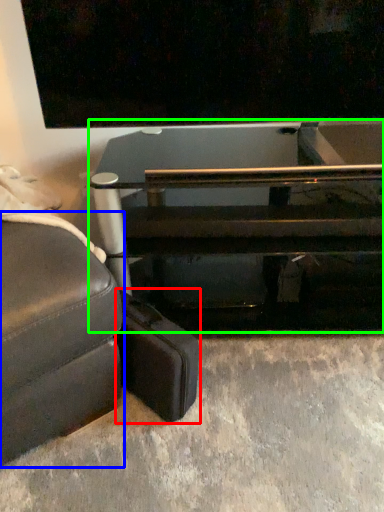
Question: Based on their relative distances, which object is farther from luggage (highlighted by a red box)? Choose from studio couch (highlighted by a blue box) and table (highlighted by a green box).

Choices:
 (A) studio couch
 (B) table

Answer: (B)